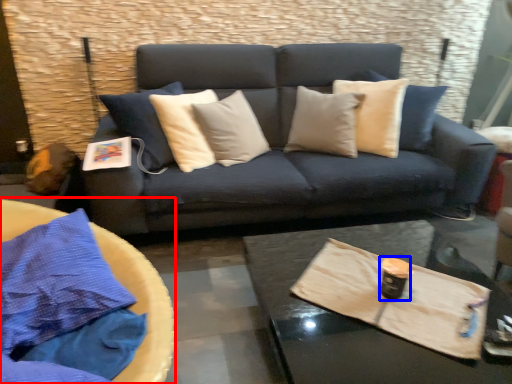
Question: Among these objects, which one is farthest to the camera, round table (highlighted by a red box) or beverage (highlighted by a blue box)?

Choices:
 (A) round table
 (B) beverage

Answer: (B)